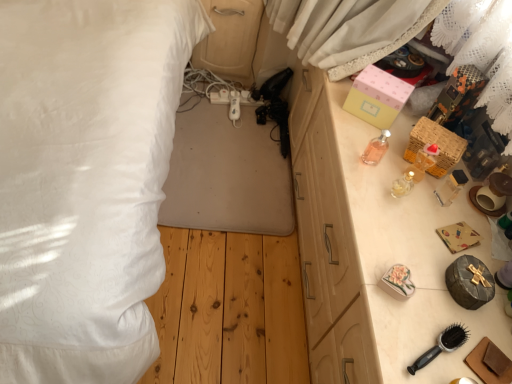
The image size is (512, 384). In order to click on empty space that is in between pink glass perfume at upper right and pink paper box at upper right, which ranks as the 1th box in top-to-bottom order in this screenshot , I will do `click(354, 129)`.